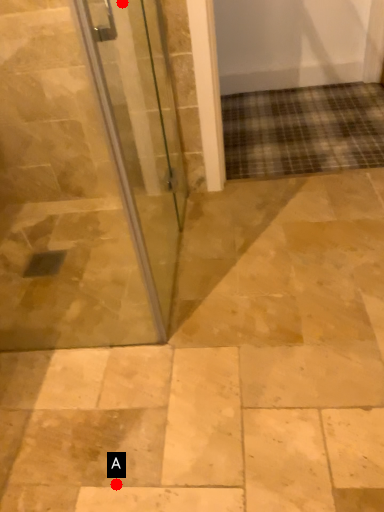
Question: Two points are circled on the image, labeled by A and B beside each circle. Which point is farther from the camera taking this photo?

Choices:
 (A) A is further
 (B) B is further

Answer: (B)